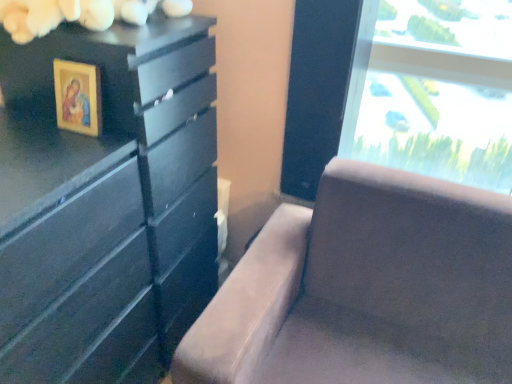
Question: Considering the relative positions of matte black dresser at left and suede-like brown couch at center in the image provided, is matte black dresser at left to the left of suede-like brown couch at center from the viewer's perspective?

Choices:
 (A) no
 (B) yes

Answer: (B)

Question: Can you confirm if matte black dresser at left is wider than suede-like brown couch at center?

Choices:
 (A) yes
 (B) no

Answer: (B)

Question: Does matte black dresser at left have a lesser width compared to suede-like brown couch at center?

Choices:
 (A) yes
 (B) no

Answer: (A)

Question: Is matte black dresser at left beside suede-like brown couch at center?

Choices:
 (A) no
 (B) yes

Answer: (A)

Question: From the image's perspective, is matte black dresser at left located beneath suede-like brown couch at center?

Choices:
 (A) no
 (B) yes

Answer: (A)

Question: From a real-world perspective, is wooden framed picture at upper left positioned above or below matte black dresser at left?

Choices:
 (A) below
 (B) above

Answer: (B)

Question: Looking at the image, does wooden framed picture at upper left seem bigger or smaller compared to matte black dresser at left?

Choices:
 (A) big
 (B) small

Answer: (B)

Question: Visually, is wooden framed picture at upper left positioned to the left or to the right of matte black dresser at left?

Choices:
 (A) left
 (B) right

Answer: (A)

Question: Is point (91, 127) positioned closer to the camera than point (187, 185)?

Choices:
 (A) closer
 (B) farther

Answer: (A)

Question: Looking at their shapes, would you say matte black dresser at left is wider or thinner than suede-like brown couch at center?

Choices:
 (A) wide
 (B) thin

Answer: (B)

Question: Would you say matte black dresser at left is to the left or to the right of suede-like brown couch at center in the picture?

Choices:
 (A) right
 (B) left

Answer: (B)

Question: Considering the positions of matte black dresser at left and suede-like brown couch at center in the image, is matte black dresser at left taller or shorter than suede-like brown couch at center?

Choices:
 (A) short
 (B) tall

Answer: (B)

Question: Is matte black dresser at left inside or outside of suede-like brown couch at center?

Choices:
 (A) inside
 (B) outside

Answer: (B)

Question: In terms of height, does wooden framed picture at upper left look taller or shorter compared to suede-like brown couch at center?

Choices:
 (A) tall
 (B) short

Answer: (B)

Question: From a real-world perspective, relative to suede-like brown couch at center, is wooden framed picture at upper left vertically above or below?

Choices:
 (A) above
 (B) below

Answer: (A)